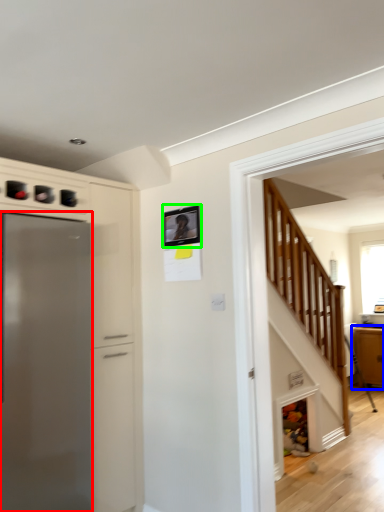
Question: Estimate the real-world distances between objects in this image. Which object is farther from refrigerator (highlighted by a red box), cabinetry (highlighted by a blue box) or picture frame (highlighted by a green box)?

Choices:
 (A) cabinetry
 (B) picture frame

Answer: (A)